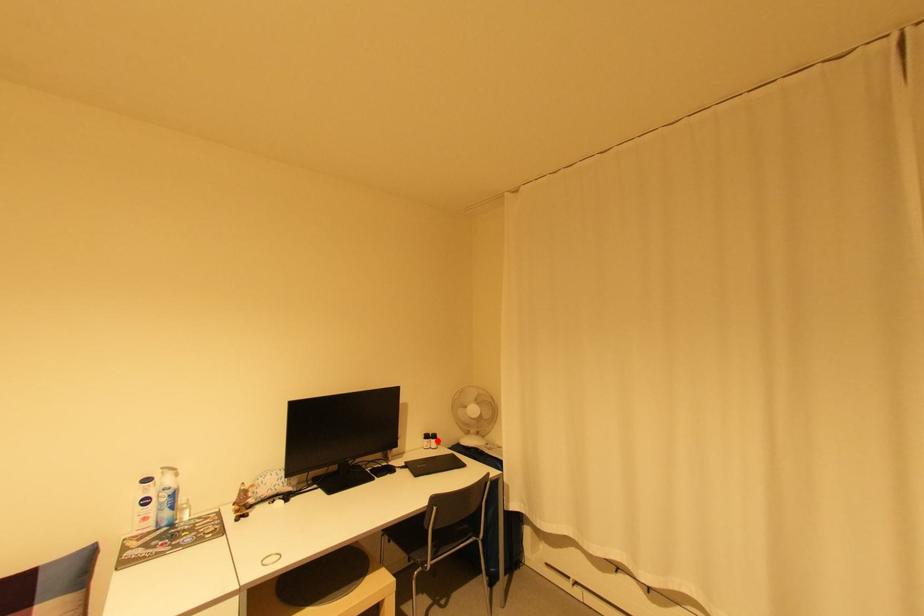
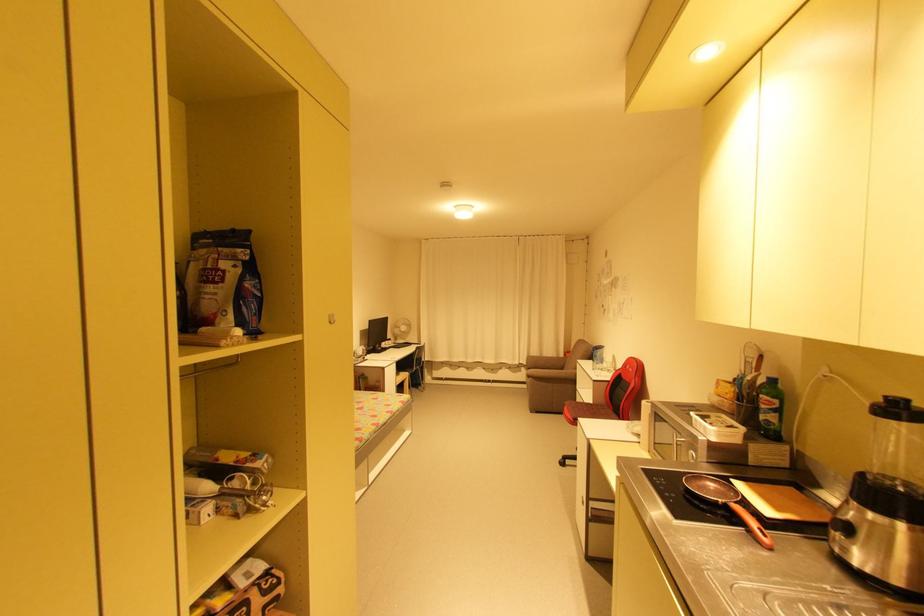
Locate, in the second image, the point that corresponds to the highlighted location in the first image.

(395, 342)